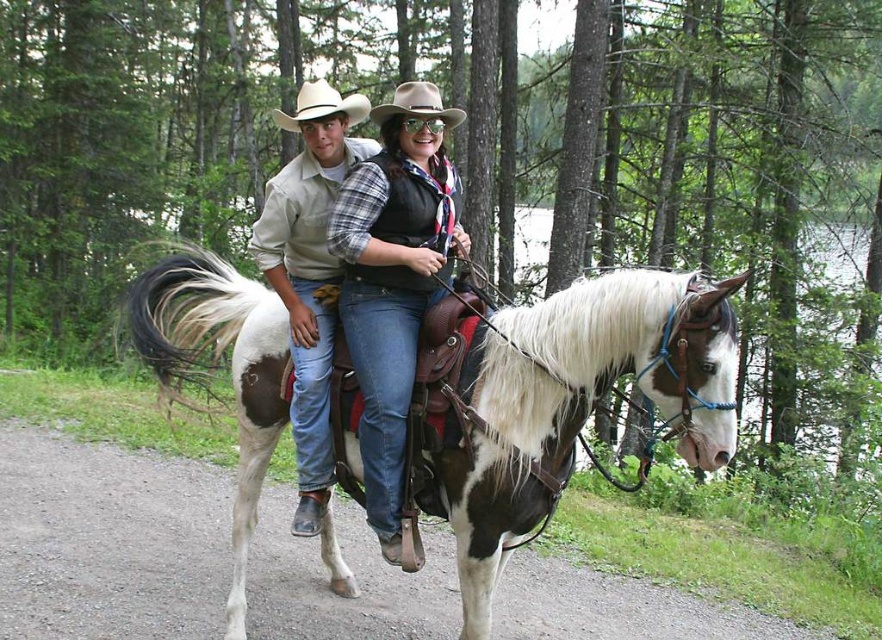
Is painted leather saddle at center closer to camera compared to matte black vest at center?

That is False.

Does painted leather saddle at center have a lesser width compared to matte black vest at center?

Indeed, painted leather saddle at center has a lesser width compared to matte black vest at center.

Find the location of a particular element. This screenshot has width=882, height=640. painted leather saddle at center is located at coordinates (580, 403).

This screenshot has width=882, height=640. Identify the location of painted leather saddle at center. (580, 403).

Is point (681, 301) less distant than point (286, 125)?

Yes, point (681, 301) is closer to viewer.

Image resolution: width=882 pixels, height=640 pixels. What are the coordinates of `painted leather saddle at center` in the screenshot? It's located at (580, 403).

Measure the distance from matte black vest at center to light brown felt cowboy hat at upper center.

The distance of matte black vest at center from light brown felt cowboy hat at upper center is 4.51 feet.

From the picture: Does matte black vest at center have a lesser width compared to light brown felt cowboy hat at upper center?

Yes, matte black vest at center is thinner than light brown felt cowboy hat at upper center.

Between point (375, 177) and point (299, 99), which one is positioned behind?

Point (299, 99)

I want to click on matte black vest at center, so click(x=357, y=282).